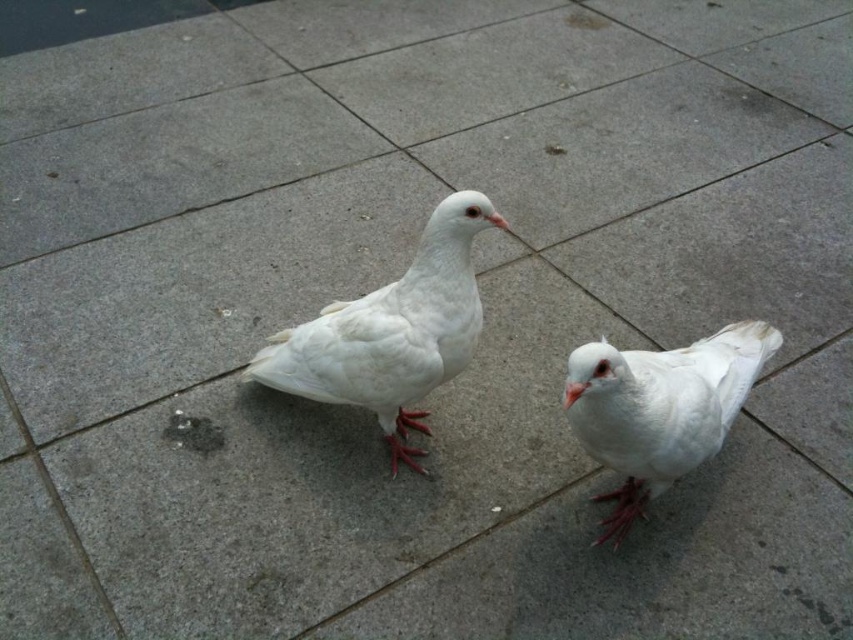
Between white matte bird at center and white matte pigeon at center, which one has less height?

Standing shorter between the two is white matte pigeon at center.

Based on the photo, between white matte bird at center and white matte pigeon at center, which one appears on the left side from the viewer's perspective?

From the viewer's perspective, white matte bird at center appears more on the left side.

Is point (463, 236) farther from camera compared to point (723, 369)?

No.

I want to click on white matte bird at center, so click(x=390, y=332).

Which is above, white matte pigeon at center or white matte beak at center?

white matte beak at center is higher up.

Between white matte pigeon at center and white matte beak at center, which one is positioned lower?

white matte pigeon at center is below.

The width and height of the screenshot is (853, 640). I want to click on white matte pigeon at center, so click(660, 408).

This screenshot has width=853, height=640. Find the location of `white matte pigeon at center`. white matte pigeon at center is located at coordinates (660, 408).

Who is higher up, white matte bird at center or orange matte beak at center?

white matte bird at center

The width and height of the screenshot is (853, 640). Describe the element at coordinates (390, 332) in the screenshot. I see `white matte bird at center` at that location.

Where is `white matte bird at center`? The width and height of the screenshot is (853, 640). white matte bird at center is located at coordinates (390, 332).